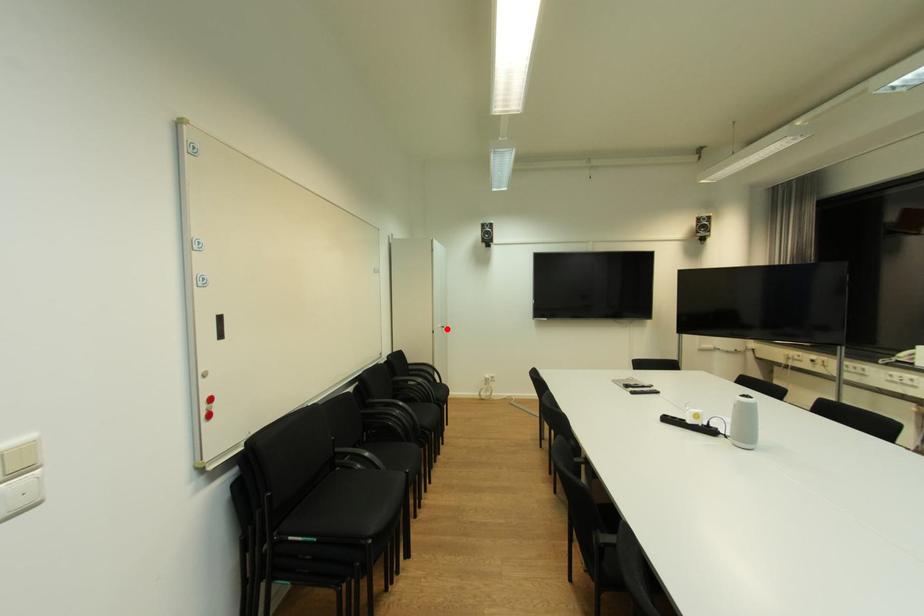
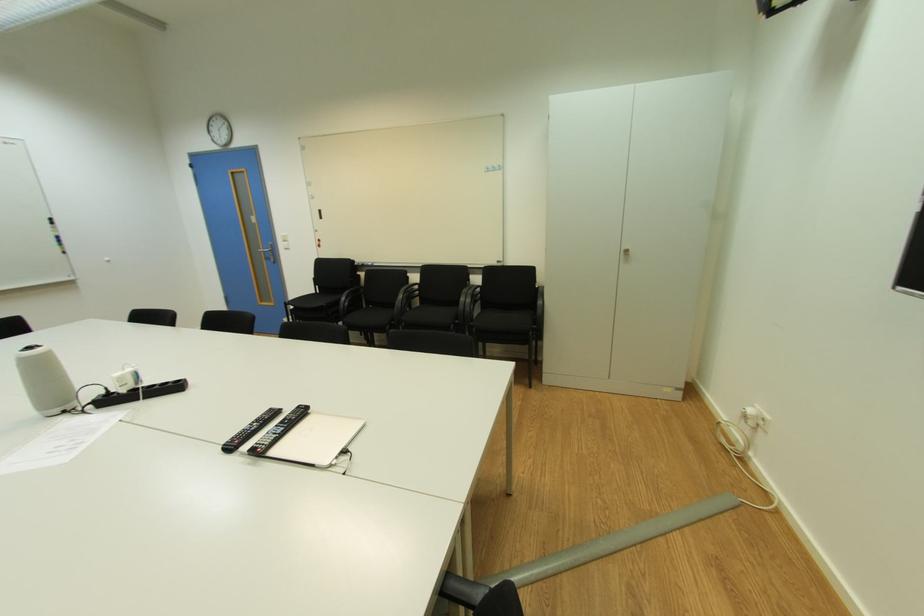
Where in the second image is the point corresponding to the highlighted location from the first image?

(628, 254)